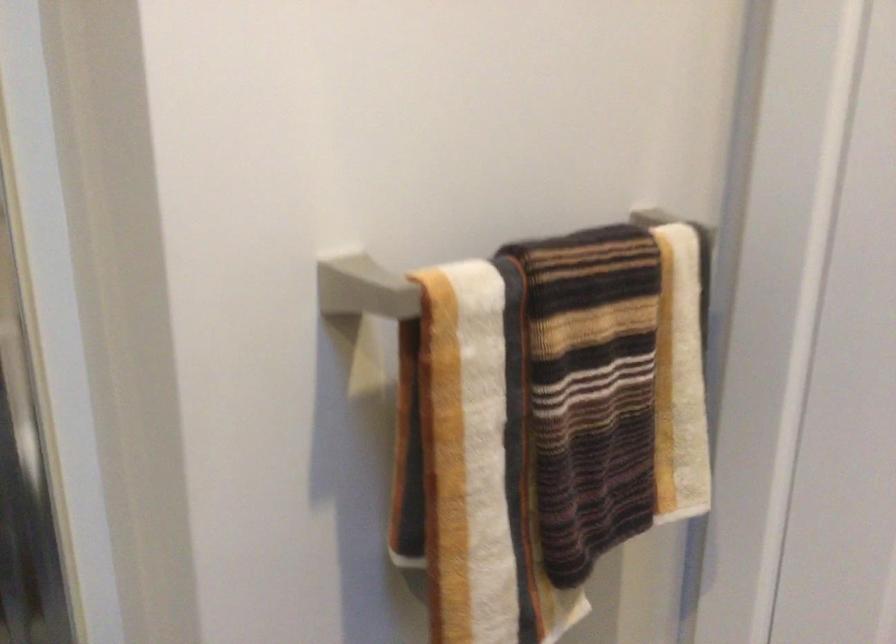
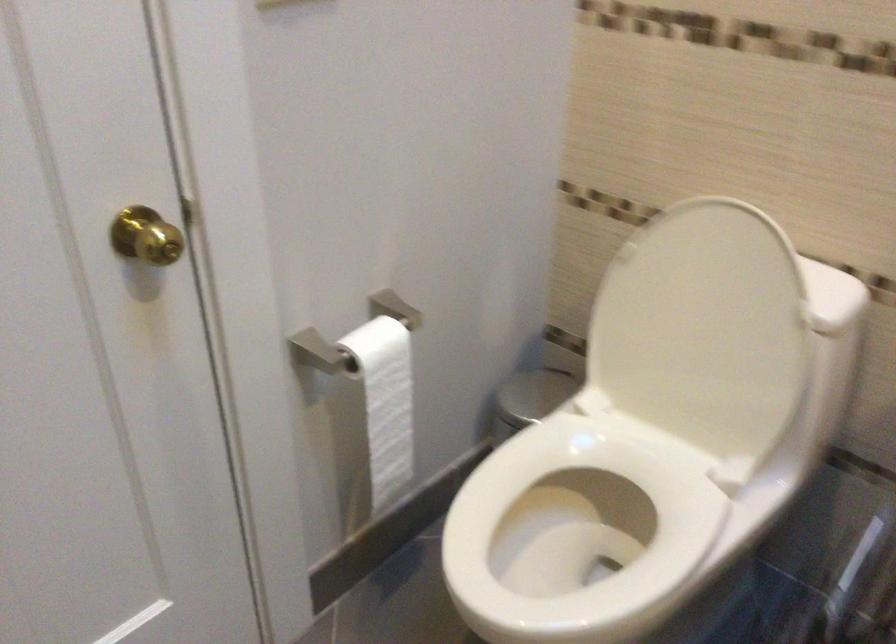
The images are taken continuously from a first-person perspective. In which direction is your viewpoint rotating?

The rotation direction of the camera is right-down.